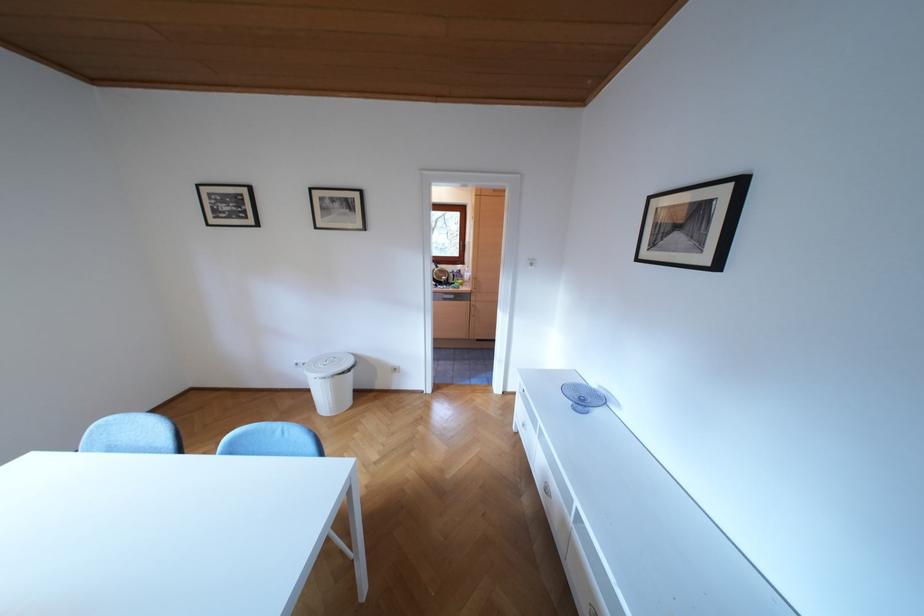
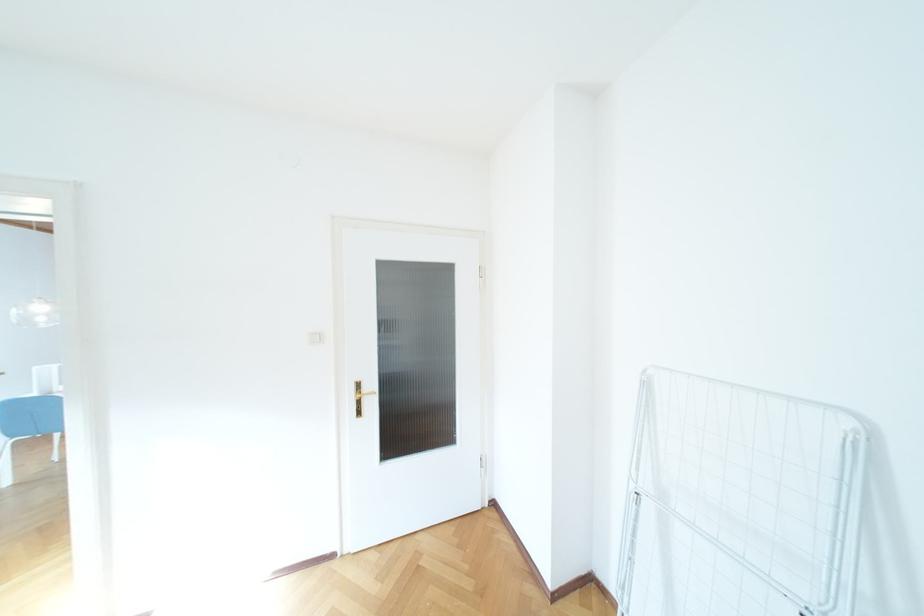
Question: I am providing you with two images of the same scene from different viewpoints. Which of the following objects are not visible in image2?

Choices:
 (A) black picture frame
 (B) brown bottle crate
 (C) white light switch
 (D) gold door handle

Answer: (A)